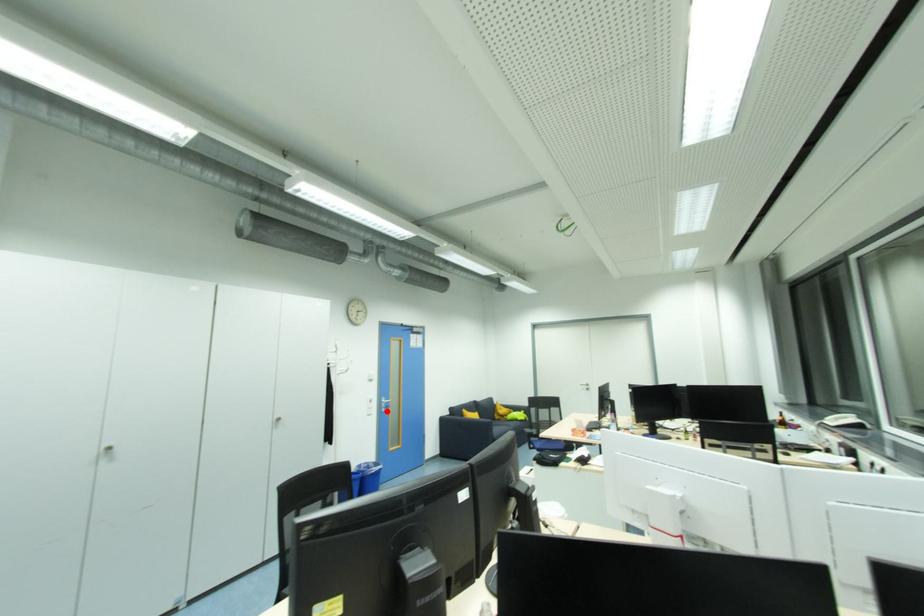
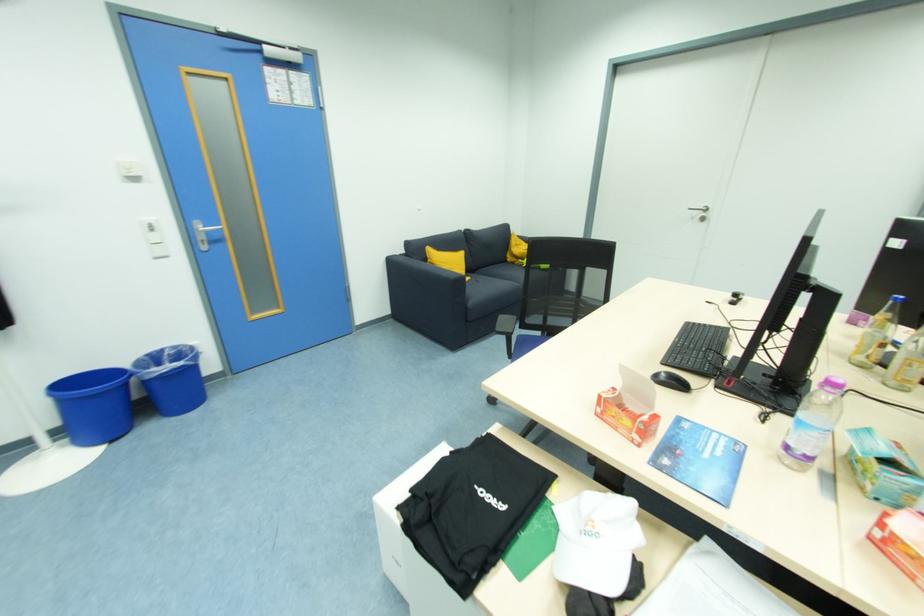
The point at the highlighted location is marked in the first image. Where is the corresponding point in the second image?

(208, 249)